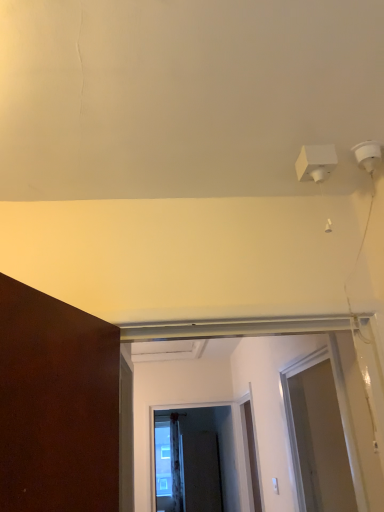
Question: Should I look upward or downward to see white matte door at center?

Choices:
 (A) up
 (B) down

Answer: (B)

Question: From the image's perspective, does transparent plastic screen door at right, the first screen door when ordered from front to back, appear lower than black matte screen door at center, which is the first screen door in bottom-to-top order?

Choices:
 (A) yes
 (B) no

Answer: (B)

Question: Is transparent plastic screen door at right, the third screen door viewed from the back, not close to black matte screen door at center, positioned as the first screen door in back-to-front order?

Choices:
 (A) yes
 (B) no

Answer: (A)

Question: From the image's perspective, is transparent plastic screen door at right, the third screen door viewed from the back, located above black matte screen door at center, positioned as the first screen door in back-to-front order?

Choices:
 (A) no
 (B) yes

Answer: (B)

Question: Is the depth of transparent plastic screen door at right, the first screen door when ordered from front to back, greater than that of black matte screen door at center, which is the first screen door in bottom-to-top order?

Choices:
 (A) no
 (B) yes

Answer: (A)

Question: Can you confirm if transparent plastic screen door at right, the first screen door when ordered from front to back, is thinner than black matte screen door at center, positioned as the first screen door in back-to-front order?

Choices:
 (A) no
 (B) yes

Answer: (B)

Question: From a real-world perspective, is transparent plastic screen door at right, acting as the third screen door starting from the bottom, under black matte screen door at center, positioned as the first screen door in back-to-front order?

Choices:
 (A) no
 (B) yes

Answer: (A)

Question: Is the surface of clear glass screen door at center, the second screen door viewed from the back, in direct contact with black matte screen door at center, which is the first screen door in bottom-to-top order?

Choices:
 (A) yes
 (B) no

Answer: (B)

Question: From the image's perspective, is clear glass screen door at center, the second screen door viewed from the back, above black matte screen door at center, positioned as the first screen door in back-to-front order?

Choices:
 (A) yes
 (B) no

Answer: (A)

Question: Is clear glass screen door at center, the second screen door viewed from the back, facing away from black matte screen door at center, arranged as the third screen door when viewed from the front?

Choices:
 (A) no
 (B) yes

Answer: (B)

Question: Does clear glass screen door at center, which appears as the second screen door when ordered from the bottom, have a greater height compared to black matte screen door at center, acting as the 3th screen door starting from the top?

Choices:
 (A) no
 (B) yes

Answer: (A)

Question: Would you consider clear glass screen door at center, which is the 2th screen door from front to back, to be distant from black matte screen door at center, positioned as the first screen door in back-to-front order?

Choices:
 (A) yes
 (B) no

Answer: (B)

Question: Is the depth of clear glass screen door at center, which appears as the second screen door when ordered from the bottom, greater than that of black matte screen door at center, positioned as the first screen door in back-to-front order?

Choices:
 (A) no
 (B) yes

Answer: (A)

Question: Does white matte door at center lie in front of clear glass screen door at center, the second screen door viewed from the back?

Choices:
 (A) yes
 (B) no

Answer: (A)